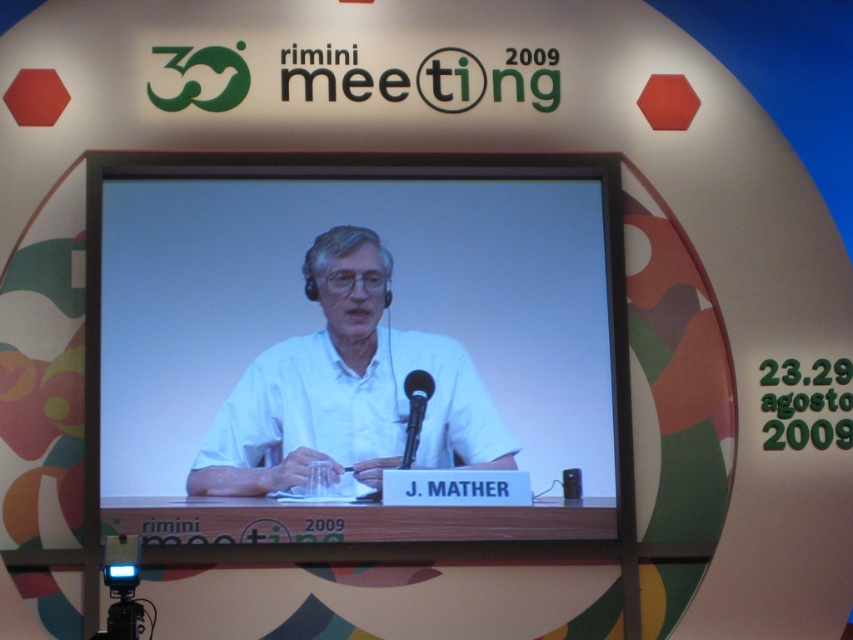
Does white matte shirt at center appear on the right side of black metallic microphone at center?

Incorrect, white matte shirt at center is not on the right side of black metallic microphone at center.

Between point (314, 420) and point (408, 433), which one is positioned behind?

Point (408, 433)

Where is `white matte shirt at center`? The width and height of the screenshot is (853, 640). white matte shirt at center is located at coordinates (347, 388).

You are a GUI agent. You are given a task and a screenshot of the screen. Output one action in this format:
    pyautogui.click(x=<x>, y=<y>)
    Task: Click on the white matte shirt at center
    The height and width of the screenshot is (640, 853).
    Given the screenshot: What is the action you would take?
    pyautogui.click(x=347, y=388)